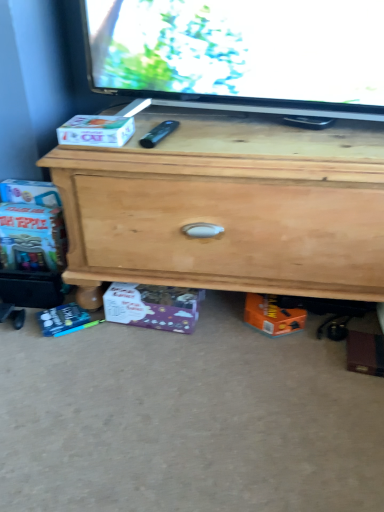
The height and width of the screenshot is (512, 384). I want to click on vacant area on top of natural wood chest of drawers at center (from a real-world perspective), so click(252, 136).